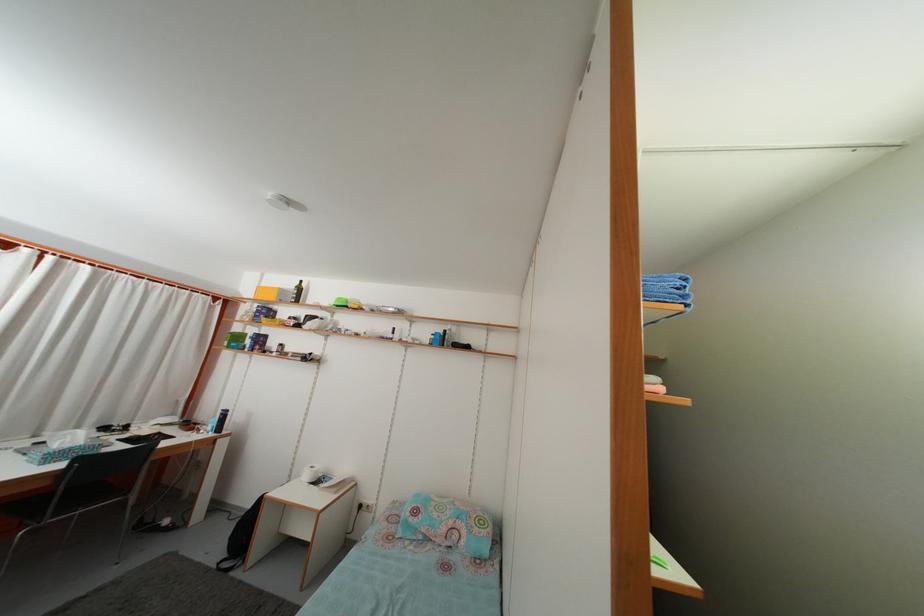
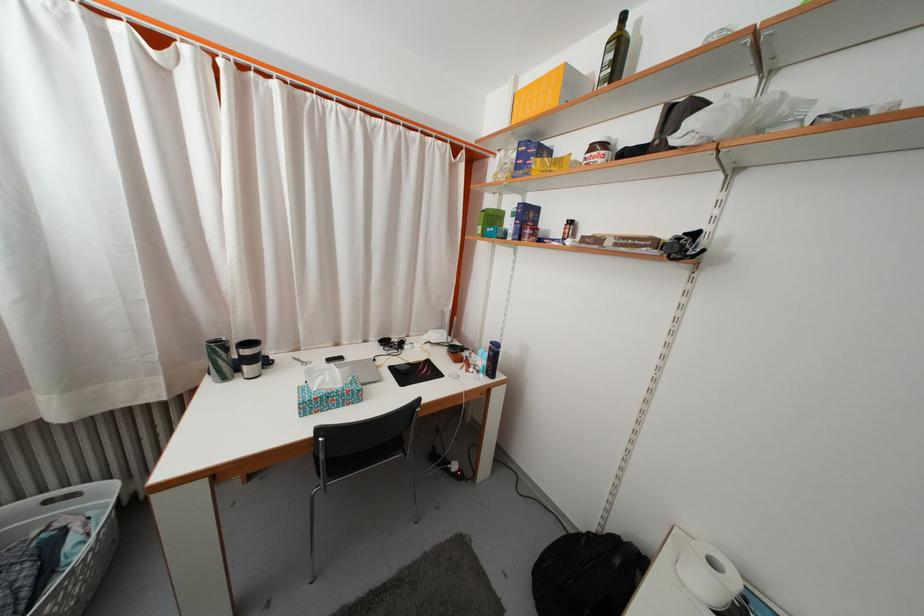
In the second image, find the point that corresponds to (x=130, y=443) in the first image.

(402, 369)